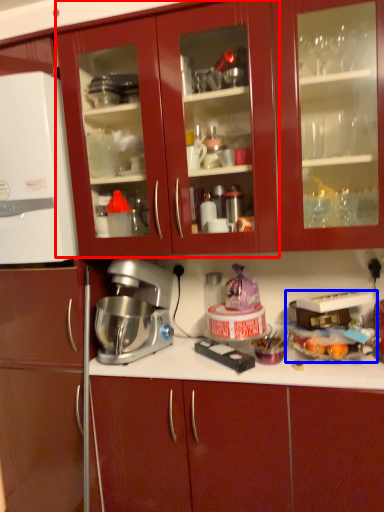
Question: Which object is further to the camera taking this photo, cabinetry (highlighted by a red box) or appliance (highlighted by a blue box)?

Choices:
 (A) cabinetry
 (B) appliance

Answer: (B)